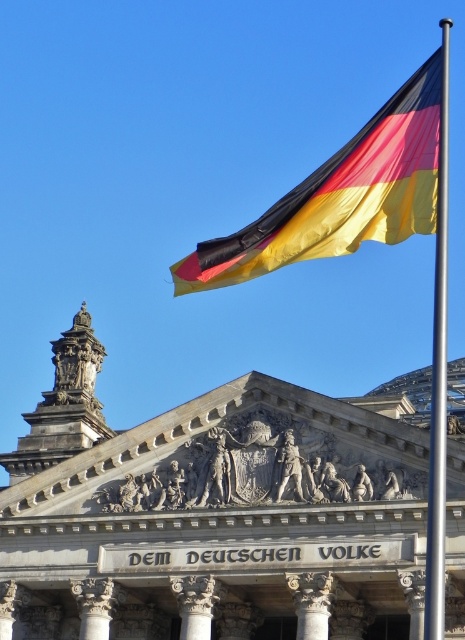
You are a tourist standing in front of the Reichstag building. You see the polyester flag at upper right and the silver metallic pole at upper right. Which object is positioned higher in the image?

The polyester flag at upper right is located above the silver metallic pole at upper right, so it is positioned higher in the image.